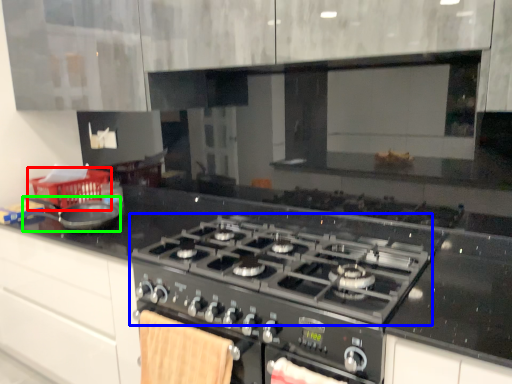
Question: Which is nearer to the basket (highlighted by a red box)? gas stove (highlighted by a blue box) or kitchen appliance (highlighted by a green box).

Choices:
 (A) gas stove
 (B) kitchen appliance

Answer: (B)